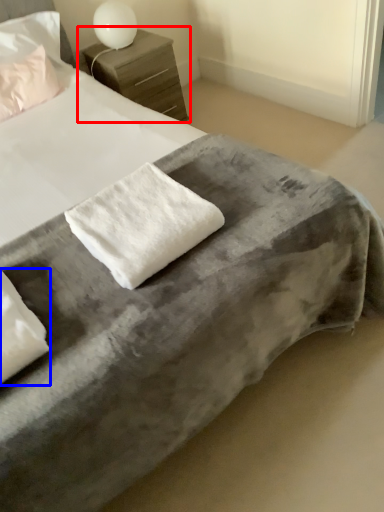
Question: Which object appears farthest to the camera in this image, nightstand (highlighted by a red box) or pillow (highlighted by a blue box)?

Choices:
 (A) nightstand
 (B) pillow

Answer: (A)